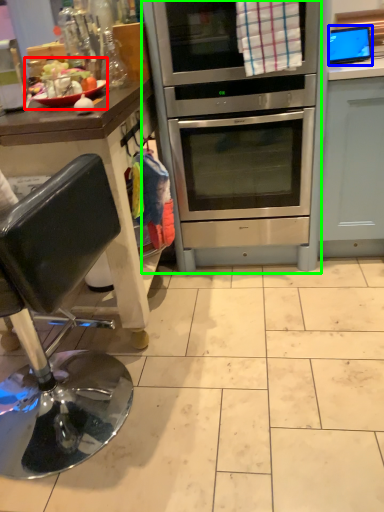
Question: Estimate the real-world distances between objects in this image. Which object is closer to food (highlighted by a red box), appliance (highlighted by a blue box) or oven (highlighted by a green box)?

Choices:
 (A) appliance
 (B) oven

Answer: (B)